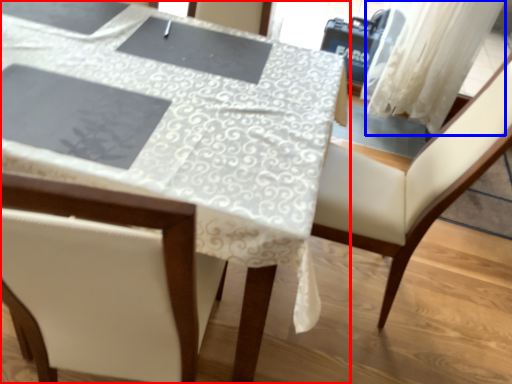
Question: Which object appears closest to the camera in this image, table (highlighted by a red box) or curtain (highlighted by a blue box)?

Choices:
 (A) table
 (B) curtain

Answer: (A)